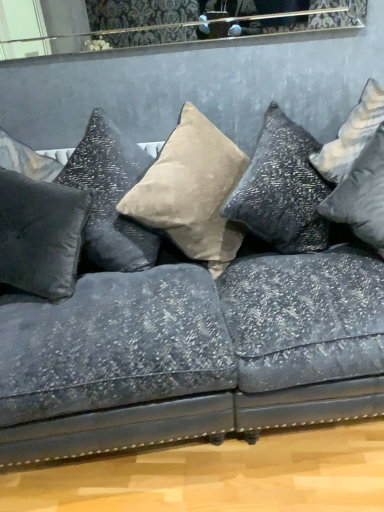
The height and width of the screenshot is (512, 384). Describe the element at coordinates (110, 196) in the screenshot. I see `satin black pillow at center, arranged as the 3th pillow when viewed from the right` at that location.

The height and width of the screenshot is (512, 384). I want to click on suede beige pillow at center, which appears as the 2th pillow when viewed from the right, so click(x=192, y=191).

Where is `silver metallic pillow at right, which appears as the 1th pillow when viewed from the right`? The height and width of the screenshot is (512, 384). silver metallic pillow at right, which appears as the 1th pillow when viewed from the right is located at coordinates (362, 195).

Is satin black pillow at center, the 2th pillow when ordered from left to right, to the left or to the right of satin black pillow at left, the fourth pillow in the right-to-left sequence, in the image?

satin black pillow at center, the 2th pillow when ordered from left to right, is positioned on satin black pillow at left, the fourth pillow in the right-to-left sequence,'s right side.

Which point is more distant from viewer, (x=105, y=151) or (x=70, y=204)?

The point (x=105, y=151) is farther from the camera.

Does satin black pillow at center, the 2th pillow when ordered from left to right, come behind satin black pillow at left, which is counted as the first pillow, starting from the left?

Yes, satin black pillow at center, the 2th pillow when ordered from left to right, is behind satin black pillow at left, which is counted as the first pillow, starting from the left.

Find the location of a particular element. The height and width of the screenshot is (512, 384). the 2nd pillow counting from the right side of the satin black pillow at center, the 2th pillow when ordered from left to right is located at coordinates (362, 195).

Based on their sizes in the image, would you say silver metallic pillow at right, which is counted as the fourth pillow, starting from the left, is bigger or smaller than satin black pillow at center, the 2th pillow when ordered from left to right?

In the image, silver metallic pillow at right, which is counted as the fourth pillow, starting from the left, appears to be smaller than satin black pillow at center, the 2th pillow when ordered from left to right.

From the image's perspective, who appears lower, silver metallic pillow at right, which is counted as the fourth pillow, starting from the left, or satin black pillow at center, arranged as the 3th pillow when viewed from the right?

silver metallic pillow at right, which is counted as the fourth pillow, starting from the left, from the image's perspective.

In the image, is silver metallic pillow at right, which is counted as the fourth pillow, starting from the left, positioned in front of or behind satin black pillow at center, arranged as the 3th pillow when viewed from the right?

Result: silver metallic pillow at right, which is counted as the fourth pillow, starting from the left, is in front of satin black pillow at center, arranged as the 3th pillow when viewed from the right.

Which object is wider, suede beige pillow at center, which is counted as the third pillow, starting from the left, or silver metallic pillow at right, which is counted as the fourth pillow, starting from the left?

Wider between the two is silver metallic pillow at right, which is counted as the fourth pillow, starting from the left.

Would you say suede beige pillow at center, which appears as the 2th pillow when viewed from the right, is outside silver metallic pillow at right, which appears as the 1th pillow when viewed from the right?

Yes.

Does suede beige pillow at center, which is counted as the third pillow, starting from the left, appear on the right side of silver metallic pillow at right, which appears as the 1th pillow when viewed from the right?

In fact, suede beige pillow at center, which is counted as the third pillow, starting from the left, is to the left of silver metallic pillow at right, which appears as the 1th pillow when viewed from the right.

From the image's perspective, is suede beige pillow at center, which is counted as the third pillow, starting from the left, located above satin black pillow at left, which is counted as the first pillow, starting from the left?

Yes.

Is satin black pillow at left, the fourth pillow in the right-to-left sequence, inside suede beige pillow at center, which appears as the 2th pillow when viewed from the right?

Actually, satin black pillow at left, the fourth pillow in the right-to-left sequence, is outside suede beige pillow at center, which appears as the 2th pillow when viewed from the right.

Is suede beige pillow at center, which is counted as the third pillow, starting from the left, to the left of satin black pillow at left, the fourth pillow in the right-to-left sequence, from the viewer's perspective?

In fact, suede beige pillow at center, which is counted as the third pillow, starting from the left, is to the right of satin black pillow at left, the fourth pillow in the right-to-left sequence.

Does satin black pillow at left, which is counted as the first pillow, starting from the left, have a lesser height compared to satin black pillow at center, the 2th pillow when ordered from left to right?

Indeed, satin black pillow at left, which is counted as the first pillow, starting from the left, has a lesser height compared to satin black pillow at center, the 2th pillow when ordered from left to right.

Considering the relative positions of satin black pillow at left, which is counted as the first pillow, starting from the left, and satin black pillow at center, arranged as the 3th pillow when viewed from the right, in the image provided, is satin black pillow at left, which is counted as the first pillow, starting from the left, to the right of satin black pillow at center, arranged as the 3th pillow when viewed from the right, from the viewer's perspective?

Incorrect, satin black pillow at left, which is counted as the first pillow, starting from the left, is not on the right side of satin black pillow at center, arranged as the 3th pillow when viewed from the right.

Consider the image. Do you think satin black pillow at left, the fourth pillow in the right-to-left sequence, is within satin black pillow at center, arranged as the 3th pillow when viewed from the right, or outside of it?

satin black pillow at left, the fourth pillow in the right-to-left sequence, exists outside the volume of satin black pillow at center, arranged as the 3th pillow when viewed from the right.

Locate an element on the screen. pillow above the satin black pillow at left, the fourth pillow in the right-to-left sequence (from a real-world perspective) is located at coordinates (110, 196).

Which object is thinner, satin black pillow at left, which is counted as the first pillow, starting from the left, or silver metallic pillow at right, which is counted as the fourth pillow, starting from the left?

Thinner between the two is satin black pillow at left, which is counted as the first pillow, starting from the left.

Is the position of satin black pillow at left, the fourth pillow in the right-to-left sequence, less distant than that of silver metallic pillow at right, which is counted as the fourth pillow, starting from the left?

No, it is behind silver metallic pillow at right, which is counted as the fourth pillow, starting from the left.

Is silver metallic pillow at right, which is counted as the fourth pillow, starting from the left, completely or partially inside satin black pillow at left, which is counted as the first pillow, starting from the left?

That's incorrect, silver metallic pillow at right, which is counted as the fourth pillow, starting from the left, is not inside satin black pillow at left, which is counted as the first pillow, starting from the left.

Does satin black pillow at left, which is counted as the first pillow, starting from the left, turn towards silver metallic pillow at right, which appears as the 1th pillow when viewed from the right?

No, satin black pillow at left, which is counted as the first pillow, starting from the left, is not aimed at silver metallic pillow at right, which appears as the 1th pillow when viewed from the right.

What are the coordinates of `pillow that is the 3rd one below the satin black pillow at center, the 2th pillow when ordered from left to right (from a real-world perspective)` in the screenshot? It's located at (362, 195).

Which object is closer to the camera, satin black pillow at center, arranged as the 3th pillow when viewed from the right, or silver metallic pillow at right, which appears as the 1th pillow when viewed from the right?

silver metallic pillow at right, which appears as the 1th pillow when viewed from the right.

Considering the relative positions of satin black pillow at center, arranged as the 3th pillow when viewed from the right, and silver metallic pillow at right, which appears as the 1th pillow when viewed from the right, in the image provided, is satin black pillow at center, arranged as the 3th pillow when viewed from the right, to the right of silver metallic pillow at right, which appears as the 1th pillow when viewed from the right, from the viewer's perspective?

In fact, satin black pillow at center, arranged as the 3th pillow when viewed from the right, is to the left of silver metallic pillow at right, which appears as the 1th pillow when viewed from the right.

Is point (116, 217) more distant than point (356, 182)?

Yes, it is.

Find the location of a particular element. the 1st pillow counting from the right side of the satin black pillow at left, the fourth pillow in the right-to-left sequence is located at coordinates (110, 196).

This screenshot has height=512, width=384. There is a silver metallic pillow at right, which is counted as the fourth pillow, starting from the left. Identify the location of the 3rd pillow above it (from a real-world perspective). (110, 196).

Looking at the image, which one is located closer to satin black pillow at left, the fourth pillow in the right-to-left sequence, suede beige pillow at center, which is counted as the third pillow, starting from the left, or silver metallic pillow at right, which appears as the 1th pillow when viewed from the right?

suede beige pillow at center, which is counted as the third pillow, starting from the left.

When comparing their distances from satin black pillow at center, arranged as the 3th pillow when viewed from the right, does silver metallic pillow at right, which appears as the 1th pillow when viewed from the right, or satin black pillow at left, the fourth pillow in the right-to-left sequence, seem closer?

satin black pillow at left, the fourth pillow in the right-to-left sequence, is closer to satin black pillow at center, arranged as the 3th pillow when viewed from the right.

Looking at the image, which one is located closer to satin black pillow at left, which is counted as the first pillow, starting from the left, silver metallic pillow at right, which is counted as the fourth pillow, starting from the left, or suede beige pillow at center, which appears as the 2th pillow when viewed from the right?

The object closer to satin black pillow at left, which is counted as the first pillow, starting from the left, is suede beige pillow at center, which appears as the 2th pillow when viewed from the right.

From the image, which object appears to be farther from suede beige pillow at center, which is counted as the third pillow, starting from the left, silver metallic pillow at right, which appears as the 1th pillow when viewed from the right, or satin black pillow at left, which is counted as the first pillow, starting from the left?

→ The object further to suede beige pillow at center, which is counted as the third pillow, starting from the left, is silver metallic pillow at right, which appears as the 1th pillow when viewed from the right.

Looking at the image, which one is located closer to satin black pillow at left, the fourth pillow in the right-to-left sequence, satin black pillow at center, the 2th pillow when ordered from left to right, or suede beige pillow at center, which is counted as the third pillow, starting from the left?

satin black pillow at center, the 2th pillow when ordered from left to right, is positioned closer to the anchor satin black pillow at left, the fourth pillow in the right-to-left sequence.

Based on their spatial positions, is satin black pillow at left, the fourth pillow in the right-to-left sequence, or suede beige pillow at center, which appears as the 2th pillow when viewed from the right, further from silver metallic pillow at right, which appears as the 1th pillow when viewed from the right?

satin black pillow at left, the fourth pillow in the right-to-left sequence, lies further to silver metallic pillow at right, which appears as the 1th pillow when viewed from the right, than the other object.

Which object lies further to the anchor point satin black pillow at left, which is counted as the first pillow, starting from the left, satin black pillow at center, the 2th pillow when ordered from left to right, or silver metallic pillow at right, which is counted as the fourth pillow, starting from the left?

Among the two, silver metallic pillow at right, which is counted as the fourth pillow, starting from the left, is located further to satin black pillow at left, which is counted as the first pillow, starting from the left.

From the image, which object appears to be farther from satin black pillow at left, which is counted as the first pillow, starting from the left, suede beige pillow at center, which is counted as the third pillow, starting from the left, or satin black pillow at center, arranged as the 3th pillow when viewed from the right?

suede beige pillow at center, which is counted as the third pillow, starting from the left, is further to satin black pillow at left, which is counted as the first pillow, starting from the left.

I want to click on pillow located between satin black pillow at center, the 2th pillow when ordered from left to right, and silver metallic pillow at right, which appears as the 1th pillow when viewed from the right, in the left-right direction, so click(192, 191).

Find the location of a particular element. Image resolution: width=384 pixels, height=512 pixels. pillow between satin black pillow at left, which is counted as the first pillow, starting from the left, and suede beige pillow at center, which appears as the 2th pillow when viewed from the right, in the horizontal direction is located at coordinates (110, 196).